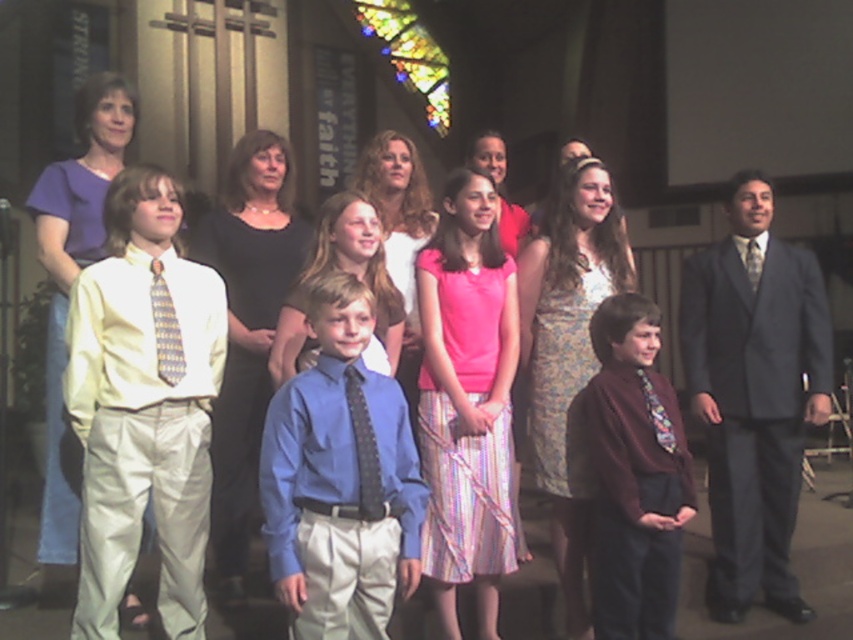
Who is more distant from viewer, [195,337] or [277,547]?

Point [195,337]

Between matte yellow shirt at left and blue satin shirt at center, which one has more height?

matte yellow shirt at left is taller.

Between point (86, 596) and point (422, 493), which one is positioned behind?

The point (86, 596) is more distant.

Find the location of a particular element. The width and height of the screenshot is (853, 640). matte yellow shirt at left is located at coordinates (143, 404).

Who is higher up, gray suit at right or maroon sweater at center?

gray suit at right is higher up.

How much distance is there between gray suit at right and maroon sweater at center?

gray suit at right is 31.55 inches away from maroon sweater at center.

Locate an element on the screen. gray suit at right is located at coordinates (753, 394).

Can you confirm if matte yellow shirt at left is smaller than maroon sweater at center?

Incorrect, matte yellow shirt at left is not smaller in size than maroon sweater at center.

Does matte yellow shirt at left have a lesser width compared to maroon sweater at center?

No.

Does point (123, 394) lie in front of point (648, 522)?

Yes.

Where is `matte yellow shirt at left`? This screenshot has height=640, width=853. matte yellow shirt at left is located at coordinates [x=143, y=404].